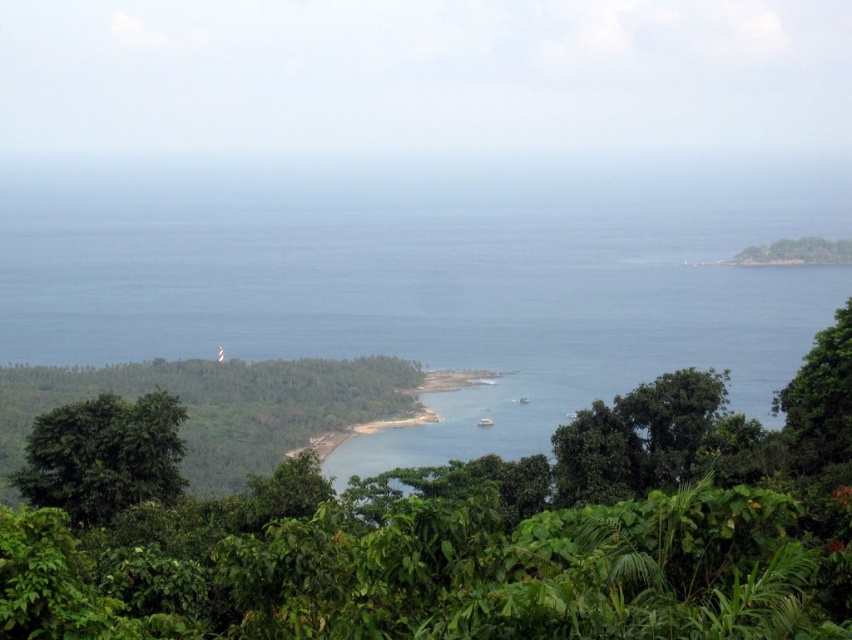
Question: Is green leafy tree at center to the right of green leafy tree at right from the viewer's perspective?

Choices:
 (A) no
 (B) yes

Answer: (A)

Question: Does green leafy jungle at center have a larger size compared to green leafy tree at right?

Choices:
 (A) yes
 (B) no

Answer: (A)

Question: In this image, where is green leafy tree at lower left located relative to green leafy tree at right?

Choices:
 (A) above
 (B) below

Answer: (B)

Question: Considering the real-world distances, which object is farthest from the green leafy jungle at center?

Choices:
 (A) green leafy tree at right
 (B) green leafy tree at center

Answer: (B)

Question: Which is farther from the green leafy tree at right?

Choices:
 (A) green leafy tree at lower left
 (B) blue water at center
 (C) green leafy tree at center
 (D) green leafy jungle at center

Answer: (B)

Question: Which object is positioned farthest from the green leafy tree at right?

Choices:
 (A) green leafy tree at lower left
 (B) green leafy tree at center
 (C) blue water at center
 (D) green leafy jungle at center

Answer: (C)